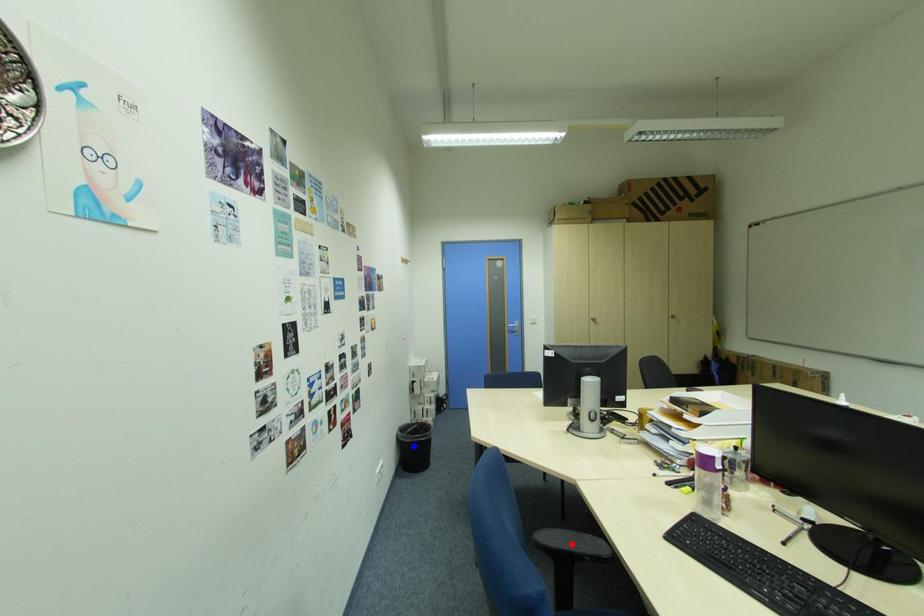
Question: Which of the two points in the image is closer to the camera?

Choices:
 (A) Blue point is closer.
 (B) Red point is closer.

Answer: (B)